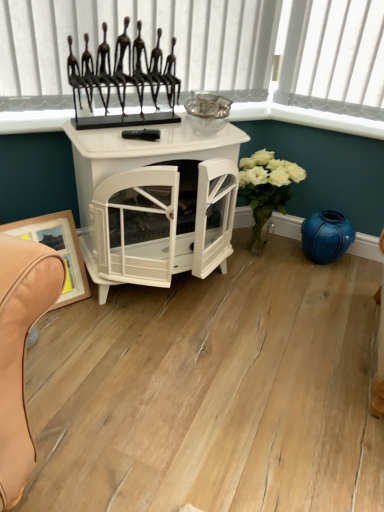
Locate an element on the screen. blue glossy vase at lower right is located at coordinates (326, 236).

You are a GUI agent. You are given a task and a screenshot of the screen. Output one action in this format:
    pyautogui.click(x=<x>, y=<y>)
    Task: Click on the metallic black stand at upper center
    
    Given the screenshot: What is the action you would take?
    pyautogui.click(x=308, y=118)

This screenshot has width=384, height=512. What are the coordinates of `metallic black sculpture at upper center` in the screenshot? It's located at (209, 56).

The image size is (384, 512). Describe the element at coordinates (209, 56) in the screenshot. I see `metallic black sculpture at upper center` at that location.

The image size is (384, 512). In order to click on white glossy fireplace at center in this screenshot , I will do `click(141, 153)`.

The width and height of the screenshot is (384, 512). What do you see at coordinates (141, 153) in the screenshot? I see `white glossy fireplace at center` at bounding box center [141, 153].

Locate an element on the screen. The height and width of the screenshot is (512, 384). wooden framed picture at lower left is located at coordinates (57, 249).

Is metallic black stand at upper center inside the boundaries of blue glossy vase at lower right, or outside?

metallic black stand at upper center lies outside blue glossy vase at lower right.

From the picture: Can you confirm if metallic black stand at upper center is shorter than blue glossy vase at lower right?

Correct, metallic black stand at upper center is not as tall as blue glossy vase at lower right.

From a real-world perspective, which object rests below the other?

blue glossy vase at lower right, from a real-world perspective.

Could you tell me if metallic black stand at upper center is turned towards blue glossy vase at lower right?

No, metallic black stand at upper center does not turn towards blue glossy vase at lower right.

Could you tell me if metallic black sculpture at upper center is facing wooden framed picture at lower left?

No, metallic black sculpture at upper center is not oriented towards wooden framed picture at lower left.

Based on the photo, is metallic black sculpture at upper center thinner than wooden framed picture at lower left?

Yes, metallic black sculpture at upper center is thinner than wooden framed picture at lower left.

Is metallic black sculpture at upper center far from wooden framed picture at lower left?

No.

Based on their sizes in the image, would you say metallic black sculpture at upper center is bigger or smaller than wooden framed picture at lower left?

metallic black sculpture at upper center is bigger than wooden framed picture at lower left.

Which object is positioned more to the left, metallic black stand at upper center or wooden framed picture at lower left?

wooden framed picture at lower left is more to the left.

From the image's perspective, who appears lower, metallic black stand at upper center or wooden framed picture at lower left?

wooden framed picture at lower left.

Can you confirm if metallic black stand at upper center is bigger than wooden framed picture at lower left?

No.

Considering the sizes of wooden framed picture at lower left and white glossy fireplace at center in the image, is wooden framed picture at lower left bigger or smaller than white glossy fireplace at center?

In the image, wooden framed picture at lower left appears to be smaller than white glossy fireplace at center.

Is wooden framed picture at lower left inside the boundaries of white glossy fireplace at center, or outside?

wooden framed picture at lower left is not inside white glossy fireplace at center, it's outside.

Between wooden framed picture at lower left and white glossy fireplace at center, which one has smaller width?

Thinner between the two is wooden framed picture at lower left.

Is metallic black sculpture at upper center at the back of blue glossy vase at lower right?

No, blue glossy vase at lower right is not facing away from metallic black sculpture at upper center.

Considering the sizes of objects blue glossy vase at lower right and metallic black sculpture at upper center in the image provided, who is taller, blue glossy vase at lower right or metallic black sculpture at upper center?

metallic black sculpture at upper center is taller.

Can we say blue glossy vase at lower right lies outside metallic black sculpture at upper center?

blue glossy vase at lower right is positioned outside metallic black sculpture at upper center.

Find the location of a particular element. This screenshot has width=384, height=512. window frame on the left of the blue glossy vase at lower right is located at coordinates (209, 56).

Is metallic black stand at upper center oriented away from white glossy fireplace at center?

No, metallic black stand at upper center's orientation is not away from white glossy fireplace at center.

Considering their positions, is metallic black stand at upper center located in front of or behind white glossy fireplace at center?

Visually, metallic black stand at upper center is located behind white glossy fireplace at center.

At what (x,y) coordinates should I click in order to perform the action: click on window sill that appears above the white glossy fireplace at center (from a real-world perspective). Please return your answer as a coordinate pair (x, y). The height and width of the screenshot is (512, 384). Looking at the image, I should click on (308, 118).

Is metallic black stand at upper center located outside white glossy fireplace at center?

Yes, metallic black stand at upper center is not within white glossy fireplace at center.

Based on the photo, are blue glossy vase at lower right and wooden framed picture at lower left located far from each other?

Absolutely, blue glossy vase at lower right is distant from wooden framed picture at lower left.

Does blue glossy vase at lower right contain wooden framed picture at lower left?

No, wooden framed picture at lower left is not inside blue glossy vase at lower right.

Based on the photo, measure the distance from blue glossy vase at lower right to wooden framed picture at lower left.

blue glossy vase at lower right and wooden framed picture at lower left are 1.08 meters apart.

Between blue glossy vase at lower right and wooden framed picture at lower left, which one appears on the left side from the viewer's perspective?

Positioned to the left is wooden framed picture at lower left.

Where is `window sill in front of the blue glossy vase at lower right`? window sill in front of the blue glossy vase at lower right is located at coordinates (308, 118).

What are the coordinates of `window frame on the right side of wooden framed picture at lower left` in the screenshot? It's located at (209, 56).

Looking at the image, which one is located further to metallic black stand at upper center, metallic black sculpture at upper center or white glossy fireplace at center?

Based on the image, white glossy fireplace at center appears to be further to metallic black stand at upper center.

Looking at the image, which one is located further to metallic black stand at upper center, wooden framed picture at lower left or white glossy fireplace at center?

wooden framed picture at lower left lies further to metallic black stand at upper center than the other object.

Estimate the real-world distances between objects in this image. Which object is further from blue glossy vase at lower right, metallic black sculpture at upper center or wooden framed picture at lower left?

wooden framed picture at lower left lies further to blue glossy vase at lower right than the other object.

When comparing their distances from wooden framed picture at lower left, does metallic black sculpture at upper center or blue glossy vase at lower right seem further?

blue glossy vase at lower right.

In the scene shown: Which object lies nearer to the anchor point wooden framed picture at lower left, metallic black stand at upper center or white glossy fireplace at center?

The object closer to wooden framed picture at lower left is white glossy fireplace at center.

Which object lies further to the anchor point wooden framed picture at lower left, blue glossy vase at lower right or metallic black stand at upper center?

blue glossy vase at lower right.

Looking at the image, which one is located closer to blue glossy vase at lower right, wooden framed picture at lower left or white glossy fireplace at center?

white glossy fireplace at center lies closer to blue glossy vase at lower right than the other object.

Looking at the image, which one is located further to wooden framed picture at lower left, white glossy fireplace at center or metallic black sculpture at upper center?

metallic black sculpture at upper center is further to wooden framed picture at lower left.

Where is `window sill that lies between metallic black sculpture at upper center and wooden framed picture at lower left from top to bottom`? The width and height of the screenshot is (384, 512). window sill that lies between metallic black sculpture at upper center and wooden framed picture at lower left from top to bottom is located at coordinates (308, 118).

Find the location of `table situated between metallic black sculpture at upper center and blue glossy vase at lower right from left to right`. table situated between metallic black sculpture at upper center and blue glossy vase at lower right from left to right is located at coordinates (141, 153).

I want to click on table between metallic black stand at upper center and wooden framed picture at lower left in the vertical direction, so click(x=141, y=153).

You are a GUI agent. You are given a task and a screenshot of the screen. Output one action in this format:
    pyautogui.click(x=<x>, y=<y>)
    Task: Click on the window frame situated between metallic black stand at upper center and blue glossy vase at lower right from left to right
    This screenshot has height=512, width=384.
    Given the screenshot: What is the action you would take?
    click(x=209, y=56)